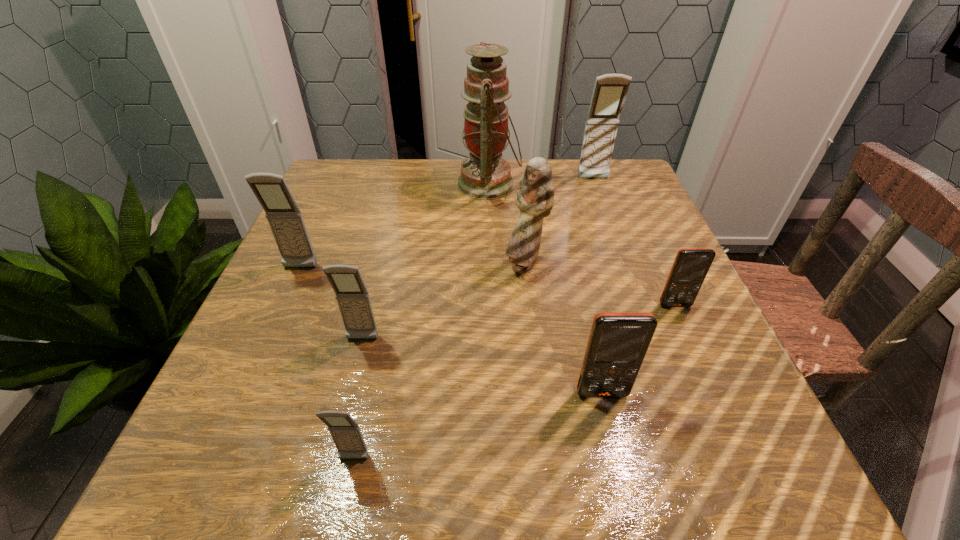
I want to click on oil lamp, so tap(484, 175).

Locate an element on the screen. This screenshot has height=540, width=960. the tallest object is located at coordinates (484, 175).

Locate an element on the screen. the farthest cellular telephone is located at coordinates (610, 90).

At what (x,y) coordinates should I click in order to perform the action: click on the biggest gray cellular telephone. Please return your answer as a coordinate pair (x, y). Image resolution: width=960 pixels, height=540 pixels. Looking at the image, I should click on (610, 90).

Where is `figurine`? figurine is located at coordinates (535, 193).

You are a GUI agent. You are given a task and a screenshot of the screen. Output one action in this format:
    pyautogui.click(x=<x>, y=<y>)
    Task: Click on the leftmost gray cellular telephone
    
    Given the screenshot: What is the action you would take?
    pyautogui.click(x=285, y=219)

This screenshot has height=540, width=960. I want to click on the fifth shortest cellular telephone, so click(285, 219).

What are the coordinates of `the second nearest gray cellular telephone` in the screenshot? It's located at (353, 299).

The width and height of the screenshot is (960, 540). I want to click on the third biggest gray cellular telephone, so click(x=353, y=299).

You are a GUI agent. You are given a task and a screenshot of the screen. Output one action in this format:
    pyautogui.click(x=<x>, y=<y>)
    Task: Click on the bigger orange cellular telephone
    
    Given the screenshot: What is the action you would take?
    pyautogui.click(x=618, y=342)